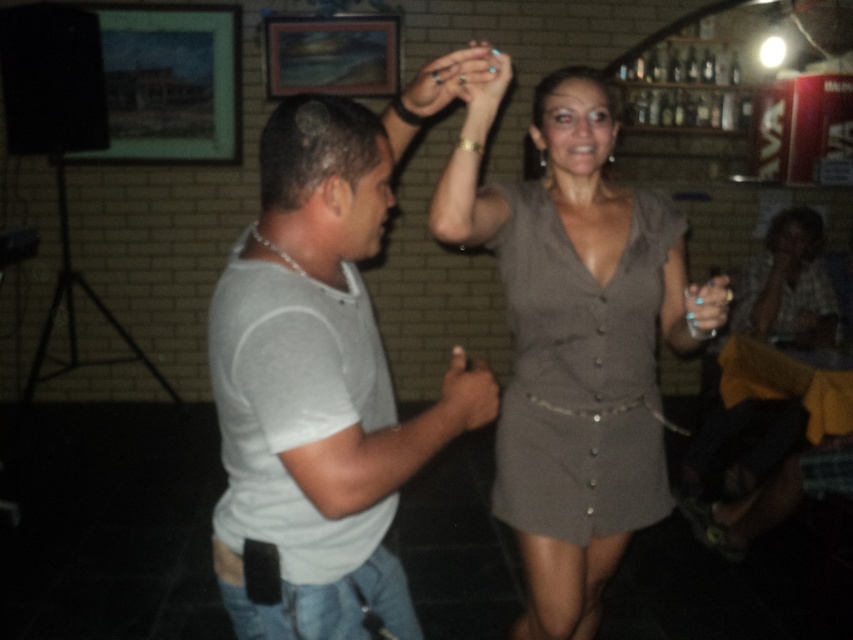
You are a photographer at the event and want to capture a photo where the gray matte dress at center and the matte gray hand at center are both clearly visible. Based on their positions, which object should you focus on first to ensure both are in sharp focus?

The gray matte dress at center is above the matte gray hand at center. To ensure both are in sharp focus, focus on the gray matte dress at center first since it is closer to the camera, and the hand will naturally fall into the depth of field if the dress is in focus.

You are a photographer at the event and want to capture both the gray matte dress at center and the matte silver ring at upper center in a single photo. Considering their sizes, which object should you focus on to ensure both are clearly visible in the frame?

The gray matte dress at center is larger in size than the matte silver ring at upper center, so focusing on the dress will allow both objects to be clearly visible in the photo.